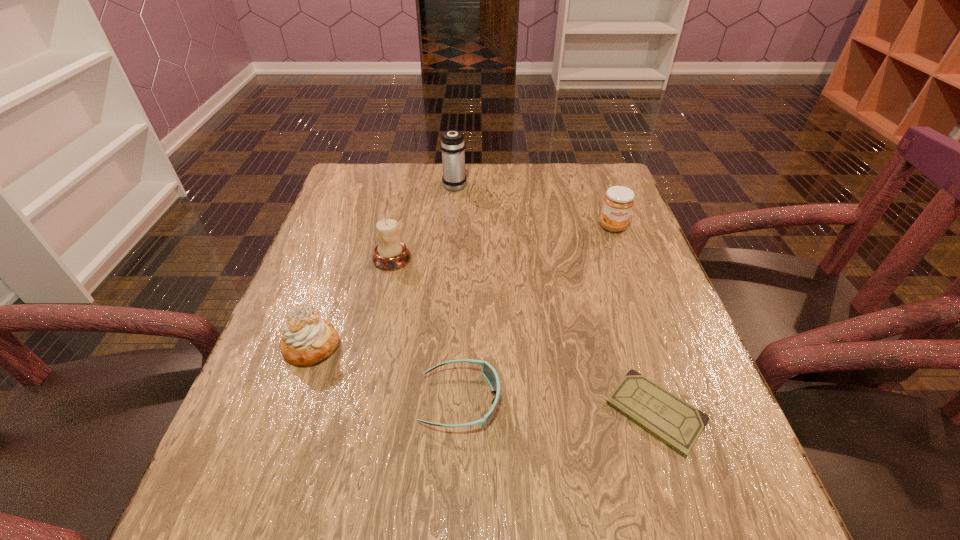
Where is `free spot located 0.100m on the front label of the jam`? free spot located 0.100m on the front label of the jam is located at coordinates (625, 261).

What are the coordinates of `free region located on the right of the third nearest object` in the screenshot? It's located at (543, 347).

Find the location of a particular element. The image size is (960, 540). free spot located on the front-facing side of the goggles is located at coordinates (625, 401).

Image resolution: width=960 pixels, height=540 pixels. I want to click on vacant region located on the left of the checkbook, so click(526, 413).

Where is `object situated at the far edge`? Image resolution: width=960 pixels, height=540 pixels. object situated at the far edge is located at coordinates (452, 144).

At what (x,y) coordinates should I click in order to perform the action: click on candle holder at the left edge. Please return your answer as a coordinate pair (x, y). Looking at the image, I should click on (390, 254).

In order to click on pastry located at the left edge in this screenshot , I will do `click(307, 339)`.

The image size is (960, 540). What are the coordinates of `jam that is at the right edge` in the screenshot? It's located at (618, 202).

Locate an element on the screen. The height and width of the screenshot is (540, 960). checkbook at the right edge is located at coordinates (678, 424).

Find the location of a particular element. free space at the far edge of the desktop is located at coordinates (555, 181).